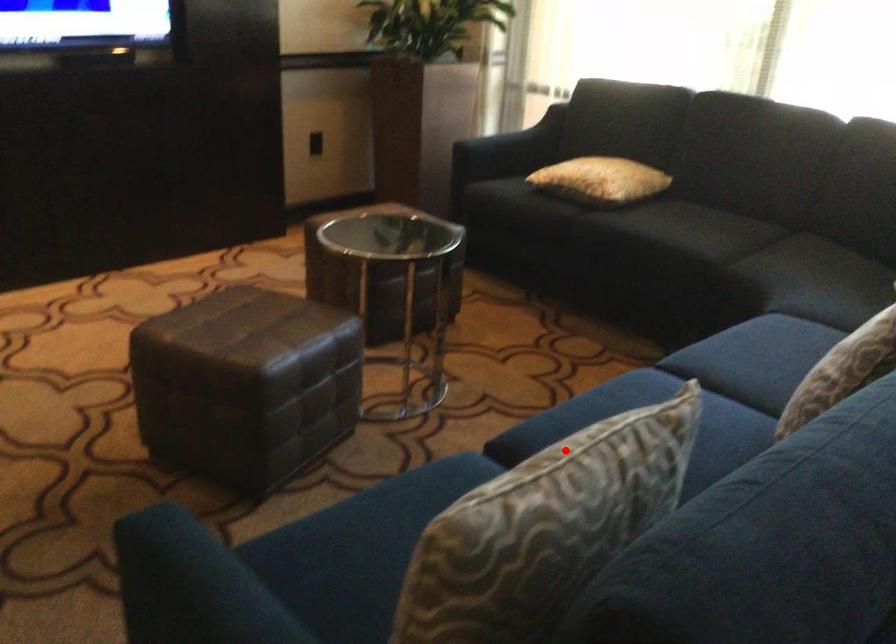
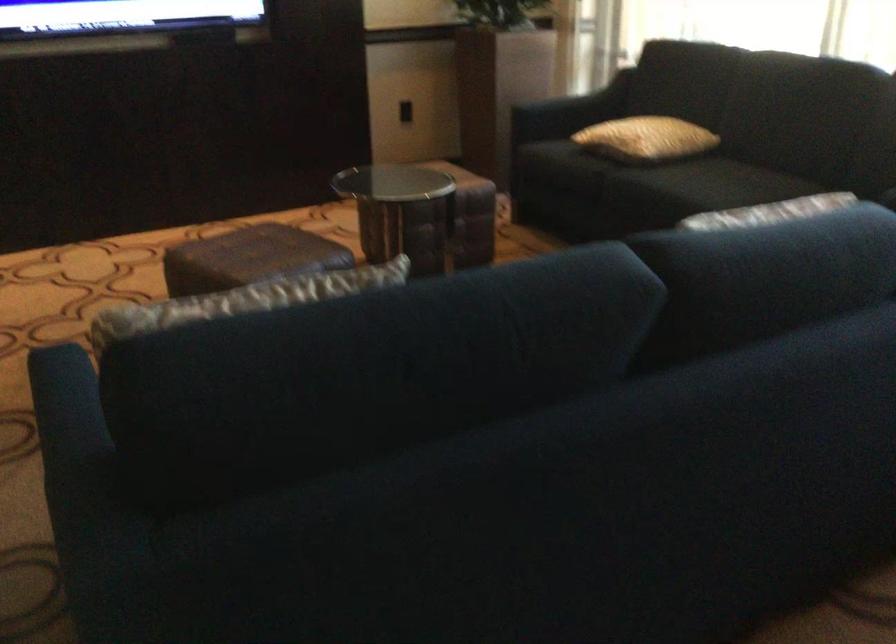
Question: I am providing you with two images of the same scene from different viewpoints. Given a red point in image1, look at the same physical point in image2. Is it:

Choices:
 (A) Closer to the viewpoint
 (B) Farther from the viewpoint

Answer: (B)